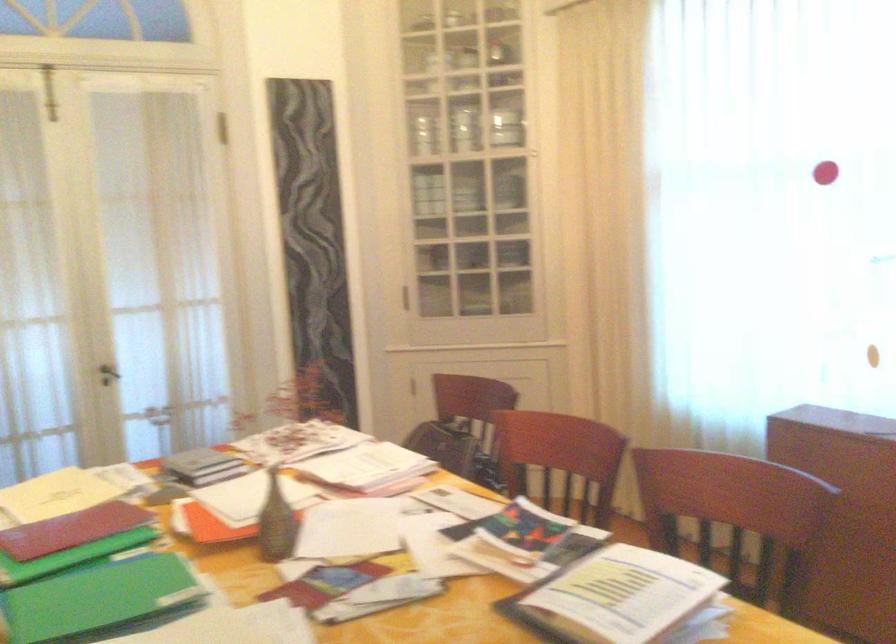
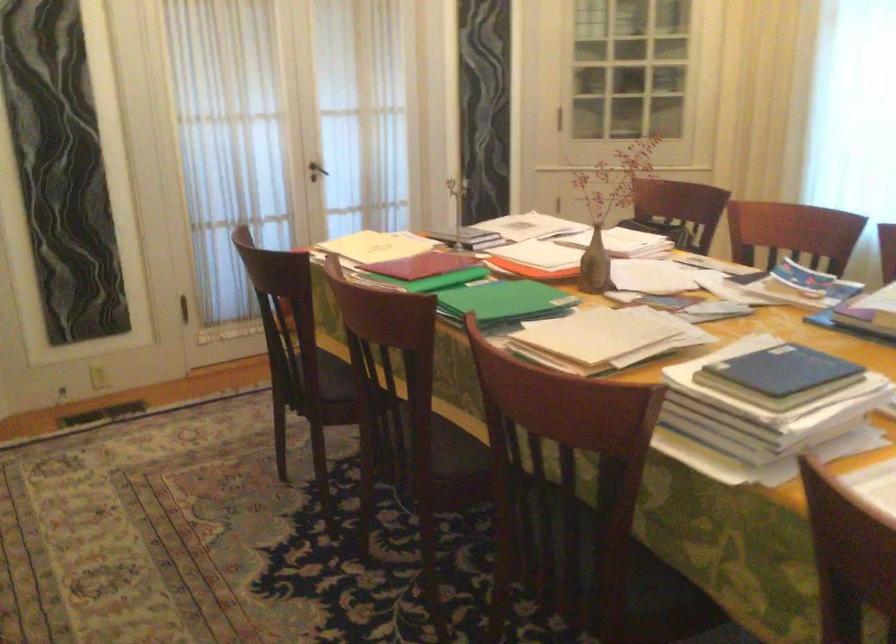
In the second image, find the point that corresponds to point 70,488 in the first image.

(376, 245)